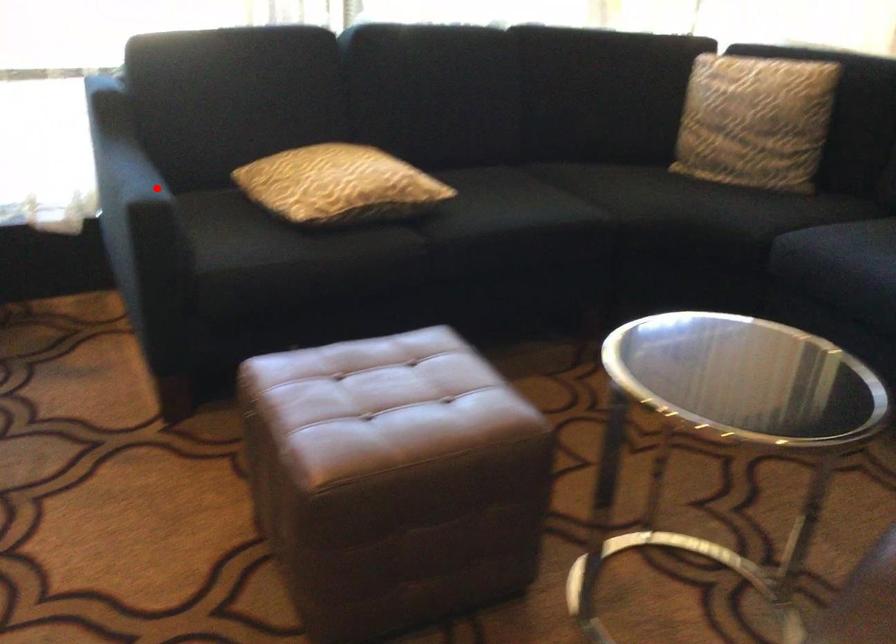
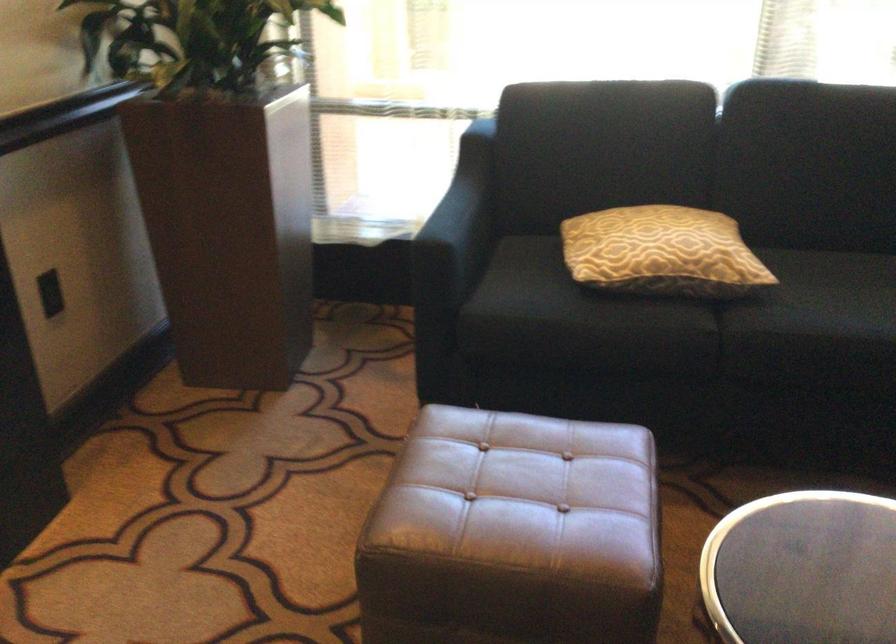
Question: I am providing you with two images of the same scene from different viewpoints. Given a red point in image1, look at the same physical point in image2. Is it:

Choices:
 (A) Closer to the viewpoint
 (B) Farther from the viewpoint

Answer: (B)